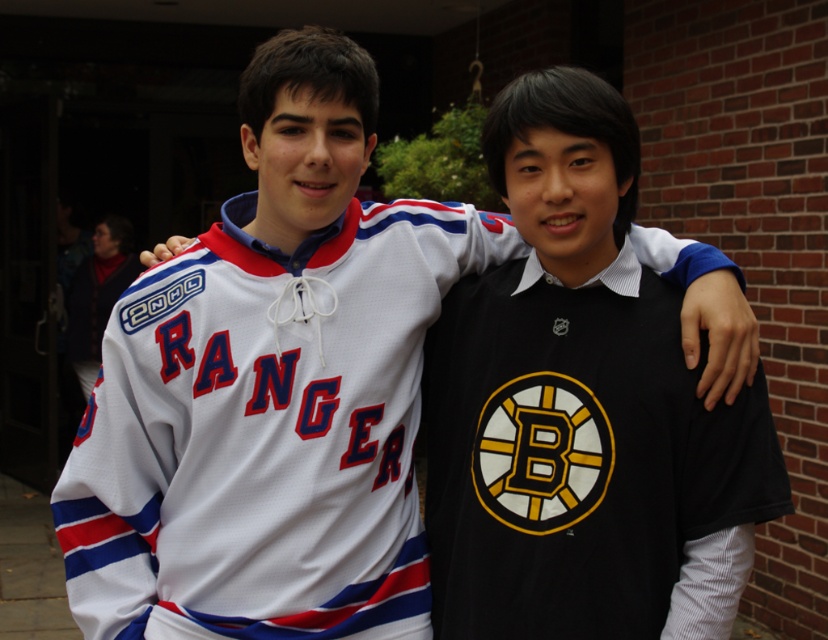
What are the coordinates of the black jersey at center?

The coordinates of the black jersey at center are at point (583, 460).

You are a photographer taking a group photo of the black jersey at center and the white jersey at center. Which jersey should you focus on first to ensure both are in frame?

The black jersey at center is smaller than the white jersey at center, so you should focus on the white jersey at center first to ensure it fits within the frame.

You are a photographer trying to capture both the black jersey at center and the white jersey at center in a single frame. Based on their positions, which jersey would you need to adjust your camera angle to include more of, and why?

The black jersey at center might be wider than the white jersey at center, so you might need to adjust your camera angle to include more of the black jersey at center to ensure it fits within the frame.